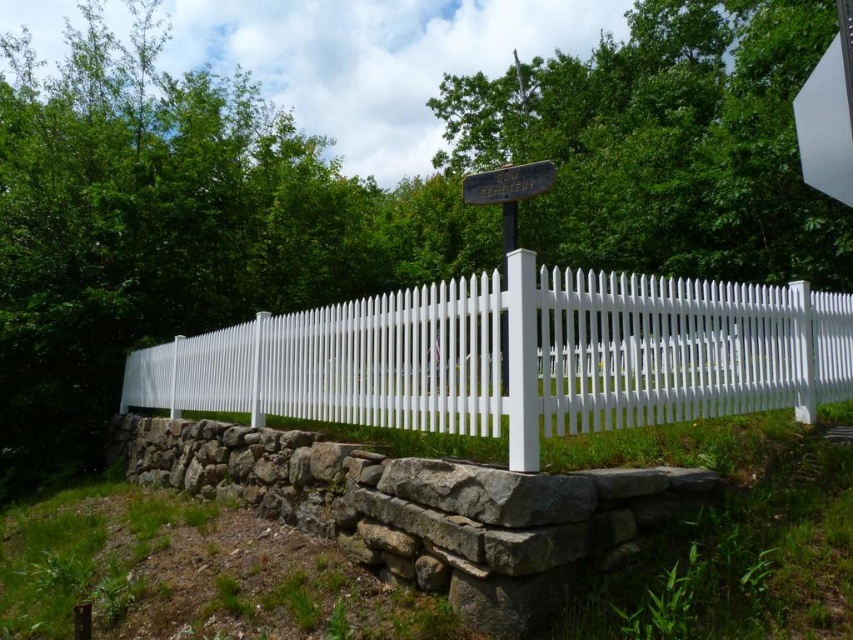
You are standing at the center of the image and want to walk towards the white painted wood picket fence at center. In which direction should you move relative to your current position?

The white painted wood picket fence at center is already at the center of the image, so you are already facing it directly. No need to move in any direction other than forward.

You are a gardener planning to install a new decorative light between the white smooth post at center and the wooden signpost at center. Based on their positions, where should the light be placed?

The white smooth post at center is below the wooden signpost at center, so the light should be placed between them along the vertical axis, above the white smooth post at center and below the wooden signpost at center.

You are a hiker who wants to place a small flag between the white smooth post at center and the wooden signpost at center. Based on their positions, which object should you stand closer to when placing the flag to ensure it is between them?

You should stand closer to the white smooth post at center because it is positioned on the left side of the wooden signpost at center, so placing the flag between them would require positioning it to the right of the white smooth post at center and to the left of the wooden signpost at center.